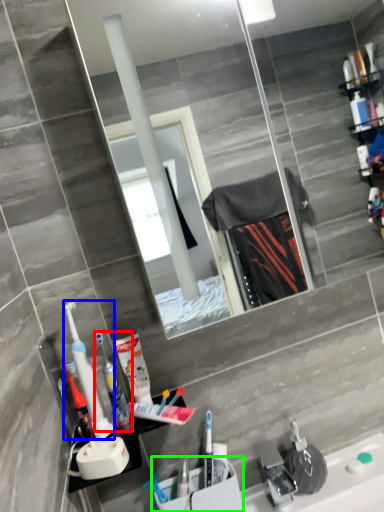
Question: Which object is the closest to the toothbrush (highlighted by a red box)? Choose among these: toothbrush (highlighted by a blue box) or sink (highlighted by a green box).

Choices:
 (A) toothbrush
 (B) sink

Answer: (A)